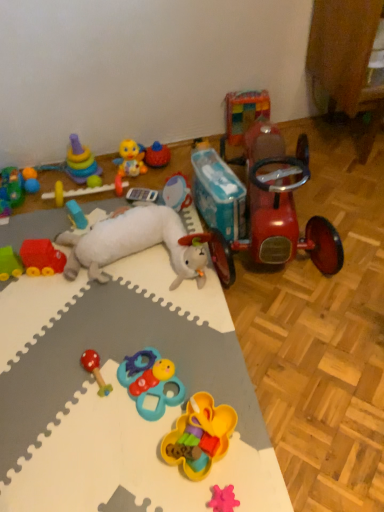
The image size is (384, 512). Identify the location of empty space that is to the right of rubberized yellow flower-shaped toy at center, the tenth toy in the left-to-right sequence. (258, 439).